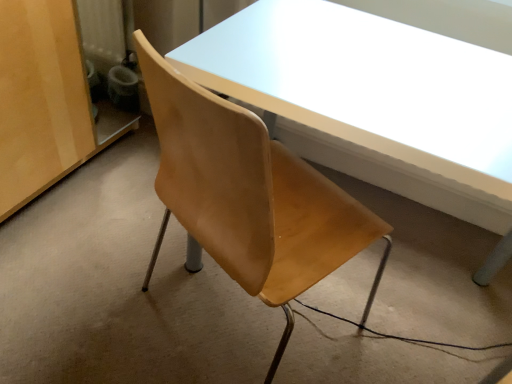
Question: Does point (112, 175) appear closer or farther from the camera than point (74, 23)?

Choices:
 (A) farther
 (B) closer

Answer: (A)

Question: Is wooden chair at center wider or thinner than matte wood cabinet at left?

Choices:
 (A) thin
 (B) wide

Answer: (B)

Question: Based on their relative distances, which object is nearer to the wooden chair at center?

Choices:
 (A) matte wood cabinet at left
 (B) matte white table at center

Answer: (A)

Question: Which object is positioned farthest from the wooden chair at center?

Choices:
 (A) matte wood cabinet at left
 (B) matte white table at center

Answer: (B)